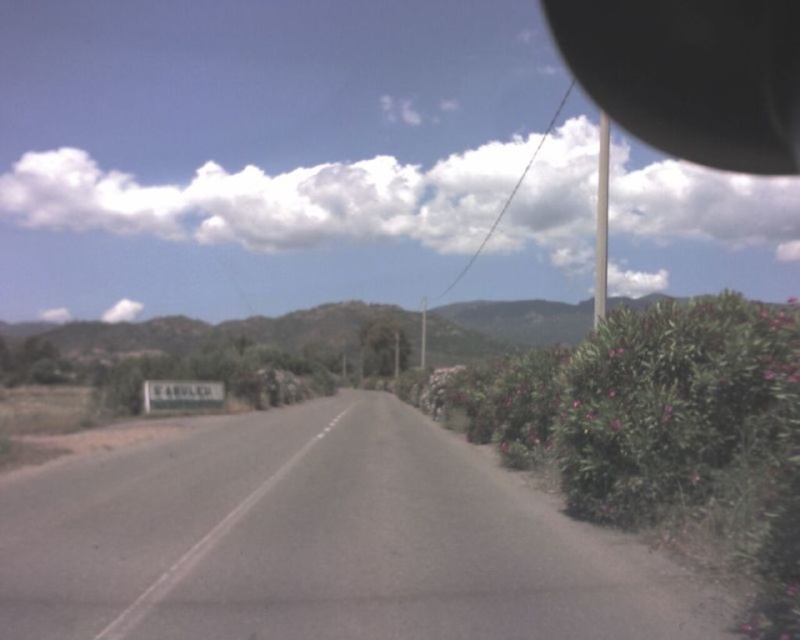
Question: Which is farther from the black rubber view mirror at upper right?

Choices:
 (A) gray metallic sign at center
 (B) asphalt road at center

Answer: (A)

Question: Which point is farther to the camera?

Choices:
 (A) black rubber view mirror at upper right
 (B) gray metallic sign at center

Answer: (B)

Question: Can you confirm if asphalt road at center is positioned to the left of gray metallic sign at center?

Choices:
 (A) yes
 (B) no

Answer: (B)

Question: Can you confirm if asphalt road at center is positioned to the left of gray metallic sign at center?

Choices:
 (A) no
 (B) yes

Answer: (A)

Question: Is asphalt road at center smaller than black rubber view mirror at upper right?

Choices:
 (A) no
 (B) yes

Answer: (B)

Question: Which object is positioned closest to the asphalt road at center?

Choices:
 (A) gray metallic sign at center
 (B) black rubber view mirror at upper right

Answer: (A)